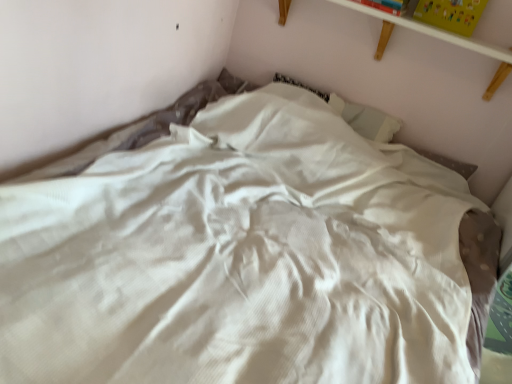
I want to click on white wooden shelf at upper center, so click(x=438, y=38).

The image size is (512, 384). I want to click on hardcover book at upper right, the 1th paperback book in the left-to-right sequence, so click(386, 5).

Image resolution: width=512 pixels, height=384 pixels. I want to click on yellow matte paper at upper right, which is counted as the 1th paperback book, starting from the right, so click(x=451, y=14).

From a real-world perspective, relative to white wooden shelf at upper center, is hardcover book at upper right, the 1th paperback book in the left-to-right sequence, vertically above or below?

Clearly, from a real-world perspective, hardcover book at upper right, the 1th paperback book in the left-to-right sequence, is above white wooden shelf at upper center.

Which object is positioned more to the right, hardcover book at upper right, the 1th paperback book in the left-to-right sequence, or white wooden shelf at upper center?

From the viewer's perspective, white wooden shelf at upper center appears more on the right side.

Is white wooden shelf at upper center at the back of hardcover book at upper right, the 1th paperback book in the left-to-right sequence?

No, hardcover book at upper right, the 1th paperback book in the left-to-right sequence, is not facing the opposite direction of white wooden shelf at upper center.

Does yellow matte paper at upper right, which is counted as the second paperback book, starting from the left, touch hardcover book at upper right, the 2th paperback book from the right?

No, yellow matte paper at upper right, which is counted as the second paperback book, starting from the left, is not touching hardcover book at upper right, the 2th paperback book from the right.

Considering the sizes of yellow matte paper at upper right, which is counted as the 1th paperback book, starting from the right, and hardcover book at upper right, the 1th paperback book in the left-to-right sequence, in the image, is yellow matte paper at upper right, which is counted as the 1th paperback book, starting from the right, taller or shorter than hardcover book at upper right, the 1th paperback book in the left-to-right sequence,?

Considering their sizes, yellow matte paper at upper right, which is counted as the 1th paperback book, starting from the right, has more height than hardcover book at upper right, the 1th paperback book in the left-to-right sequence.

Measure the distance from yellow matte paper at upper right, which is counted as the 1th paperback book, starting from the right, to hardcover book at upper right, the 2th paperback book from the right.

A distance of 6.70 inches exists between yellow matte paper at upper right, which is counted as the 1th paperback book, starting from the right, and hardcover book at upper right, the 2th paperback book from the right.

Considering the sizes of yellow matte paper at upper right, which is counted as the second paperback book, starting from the left, and hardcover book at upper right, the 1th paperback book in the left-to-right sequence, in the image, is yellow matte paper at upper right, which is counted as the second paperback book, starting from the left, wider or thinner than hardcover book at upper right, the 1th paperback book in the left-to-right sequence,?

yellow matte paper at upper right, which is counted as the second paperback book, starting from the left, is thinner than hardcover book at upper right, the 1th paperback book in the left-to-right sequence.

Can you see white wooden shelf at upper center touching yellow matte paper at upper right, which is counted as the second paperback book, starting from the left?

No, white wooden shelf at upper center is not in contact with yellow matte paper at upper right, which is counted as the second paperback book, starting from the left.

From the image's perspective, who appears lower, white wooden shelf at upper center or yellow matte paper at upper right, which is counted as the second paperback book, starting from the left?

white wooden shelf at upper center.

Would you say white wooden shelf at upper center is to the left or to the right of yellow matte paper at upper right, which is counted as the second paperback book, starting from the left, in the picture?

white wooden shelf at upper center is positioned on yellow matte paper at upper right, which is counted as the second paperback book, starting from the left,'s left side.

Is yellow matte paper at upper right, which is counted as the second paperback book, starting from the left, with white wooden shelf at upper center?

No, yellow matte paper at upper right, which is counted as the second paperback book, starting from the left, is not touching white wooden shelf at upper center.

Where is `shelf that appears below the yellow matte paper at upper right, which is counted as the 1th paperback book, starting from the right (from a real-world perspective)`? This screenshot has width=512, height=384. shelf that appears below the yellow matte paper at upper right, which is counted as the 1th paperback book, starting from the right (from a real-world perspective) is located at coordinates pos(438,38).

How different are the orientations of yellow matte paper at upper right, which is counted as the second paperback book, starting from the left, and white wooden shelf at upper center in degrees?

The facing directions of yellow matte paper at upper right, which is counted as the second paperback book, starting from the left, and white wooden shelf at upper center are 0.554 degrees apart.

Which is more to the left, white wooden shelf at upper center or hardcover book at upper right, the 1th paperback book in the left-to-right sequence?

From the viewer's perspective, hardcover book at upper right, the 1th paperback book in the left-to-right sequence, appears more on the left side.

Considering the points (464, 44) and (384, 0), which point is in front, point (464, 44) or point (384, 0)?

Point (464, 44)

From a real-world perspective, is white wooden shelf at upper center located higher than hardcover book at upper right, the 2th paperback book from the right?

No.

Is the depth of white wooden shelf at upper center less than that of hardcover book at upper right, the 1th paperback book in the left-to-right sequence?

Yes, it is in front of hardcover book at upper right, the 1th paperback book in the left-to-right sequence.

Which point is more forward, (x=380, y=3) or (x=448, y=16)?

Positioned in front is point (x=448, y=16).

Does hardcover book at upper right, the 1th paperback book in the left-to-right sequence, lie behind yellow matte paper at upper right, which is counted as the second paperback book, starting from the left?

Yes.

Can you tell me how much hardcover book at upper right, the 1th paperback book in the left-to-right sequence, and yellow matte paper at upper right, which is counted as the 1th paperback book, starting from the right, differ in facing direction?

0.00287 degrees.

Is yellow matte paper at upper right, which is counted as the 1th paperback book, starting from the right, located within hardcover book at upper right, the 2th paperback book from the right?

No, yellow matte paper at upper right, which is counted as the 1th paperback book, starting from the right, is located outside of hardcover book at upper right, the 2th paperback book from the right.

You are a GUI agent. You are given a task and a screenshot of the screen. Output one action in this format:
    pyautogui.click(x=<x>, y=<y>)
    Task: Click on the 1st paperback book positioned above the white wooden shelf at upper center (from a real-world perspective)
    The height and width of the screenshot is (384, 512).
    Given the screenshot: What is the action you would take?
    pyautogui.click(x=386, y=5)

You are a GUI agent. You are given a task and a screenshot of the screen. Output one action in this format:
    pyautogui.click(x=<x>, y=<y>)
    Task: Click on the paperback book in front of the hardcover book at upper right, the 1th paperback book in the left-to-right sequence
    The height and width of the screenshot is (384, 512).
    Given the screenshot: What is the action you would take?
    pyautogui.click(x=451, y=14)

Which object lies nearer to the anchor point white wooden shelf at upper center, hardcover book at upper right, the 2th paperback book from the right, or yellow matte paper at upper right, which is counted as the second paperback book, starting from the left?

yellow matte paper at upper right, which is counted as the second paperback book, starting from the left, is closer to white wooden shelf at upper center.

Based on their spatial positions, is white wooden shelf at upper center or yellow matte paper at upper right, which is counted as the 1th paperback book, starting from the right, closer to hardcover book at upper right, the 1th paperback book in the left-to-right sequence?

white wooden shelf at upper center.

Based on their spatial positions, is hardcover book at upper right, the 1th paperback book in the left-to-right sequence, or white wooden shelf at upper center further from yellow matte paper at upper right, which is counted as the second paperback book, starting from the left?

hardcover book at upper right, the 1th paperback book in the left-to-right sequence, is further to yellow matte paper at upper right, which is counted as the second paperback book, starting from the left.

Based on their spatial positions, is white wooden shelf at upper center or hardcover book at upper right, the 1th paperback book in the left-to-right sequence, closer to yellow matte paper at upper right, which is counted as the 1th paperback book, starting from the right?

The object closer to yellow matte paper at upper right, which is counted as the 1th paperback book, starting from the right, is white wooden shelf at upper center.

Which object lies nearer to the anchor point white wooden shelf at upper center, yellow matte paper at upper right, which is counted as the second paperback book, starting from the left, or hardcover book at upper right, the 1th paperback book in the left-to-right sequence?

yellow matte paper at upper right, which is counted as the second paperback book, starting from the left.

Considering their positions, is yellow matte paper at upper right, which is counted as the second paperback book, starting from the left, positioned closer to hardcover book at upper right, the 1th paperback book in the left-to-right sequence, than white wooden shelf at upper center?

Based on the image, white wooden shelf at upper center appears to be nearer to hardcover book at upper right, the 1th paperback book in the left-to-right sequence.

Locate an element on the screen. This screenshot has height=384, width=512. shelf between hardcover book at upper right, the 2th paperback book from the right, and yellow matte paper at upper right, which is counted as the 1th paperback book, starting from the right, from left to right is located at coordinates (438, 38).